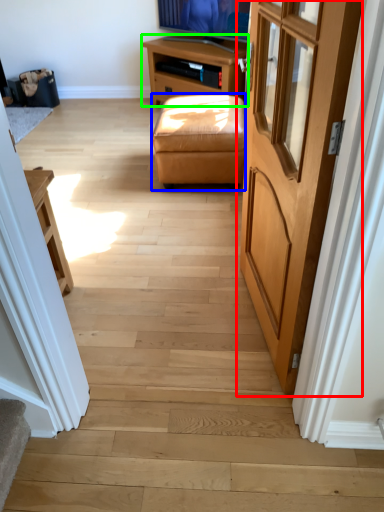
Question: Which object is positioned farthest from door (highlighted by a red box)? Select from stool (highlighted by a blue box) and table (highlighted by a green box).

Choices:
 (A) stool
 (B) table

Answer: (B)